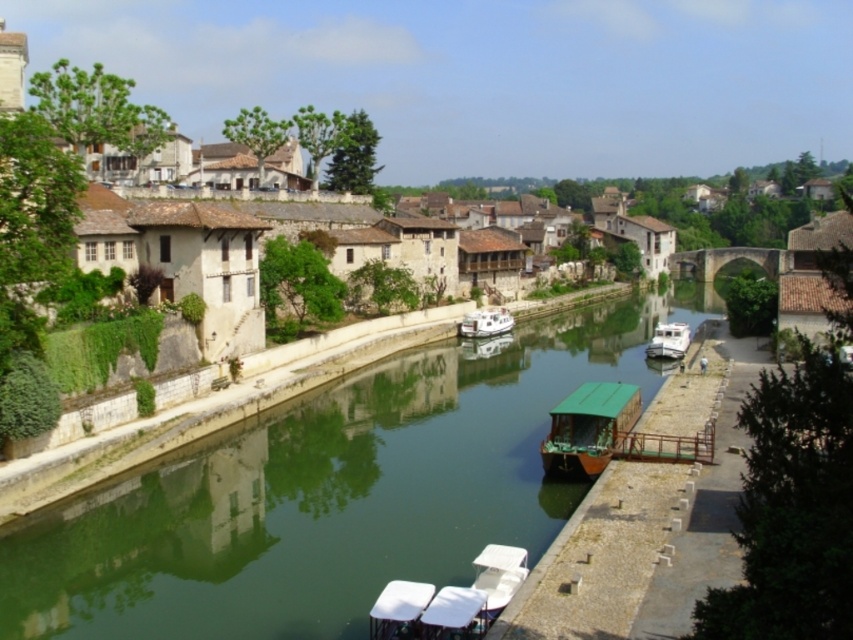
You are standing at the point with coordinates (599, 451) in the riverside scene. You want to move towards the point at (471, 445). Is the path between these two points clear of any obstructions?

The point at (471, 445) is behind the point at (599, 451), so the path between them is obstructed by the latter point.